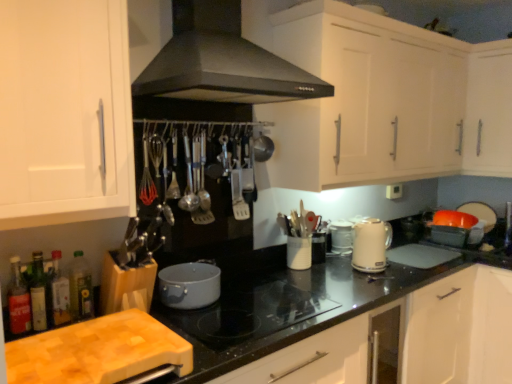
Locate an element on the screen. The height and width of the screenshot is (384, 512). free space to the right of beige glossy electric kettle at right is located at coordinates (408, 266).